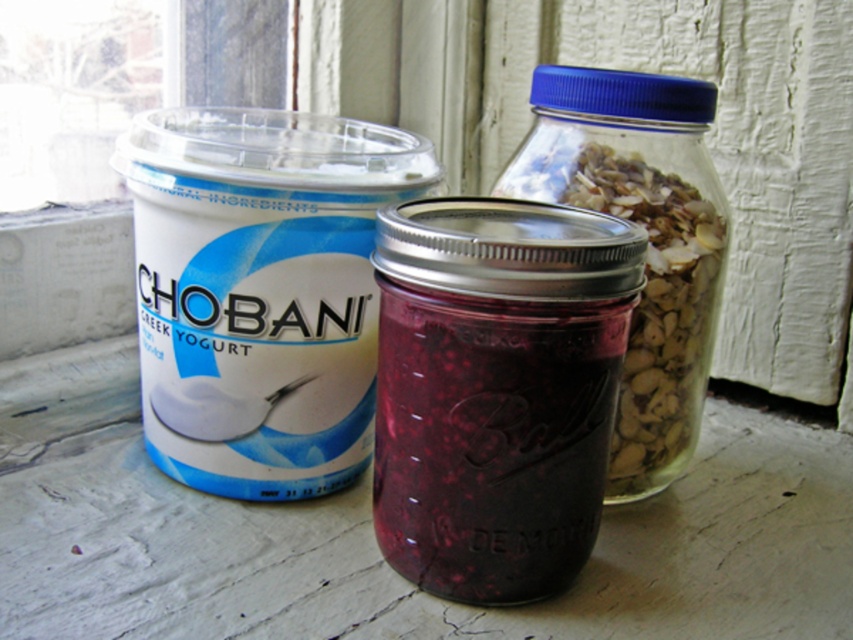
Is point (212, 232) farther from viewer compared to point (697, 412)?

No, it is in front of (697, 412).

I want to click on white matte yogurt at left, so click(260, 291).

Who is more forward, [285,227] or [634,349]?

Point [285,227] is in front.

Locate an element on the screen. The image size is (853, 640). white matte yogurt at left is located at coordinates (260, 291).